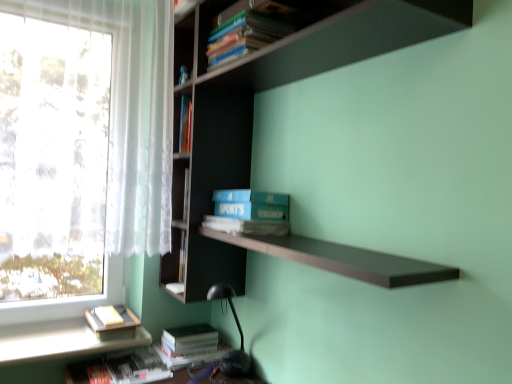
Measure the distance between point (176, 367) and camera.

1.73 meters.

This screenshot has height=384, width=512. What do you see at coordinates (60, 341) in the screenshot?
I see `white matte window sill at lower left` at bounding box center [60, 341].

This screenshot has width=512, height=384. What do you see at coordinates (112, 324) in the screenshot?
I see `hardcover book at lower left, the third book in the top-to-bottom sequence` at bounding box center [112, 324].

Find the location of a particular element. matte blue book at upper center, the fourth book in the bottom-to-top sequence is located at coordinates (183, 75).

Identify the location of hardcover book at lower left, the second book when ordered from bottom to top. The width and height of the screenshot is (512, 384). (190, 345).

Is hardcover book at lower left, the fourth book from the top, facing away from white matte window sill at lower left?

No.

How distant is hardcover book at lower left, the second book when ordered from bottom to top, from white matte window sill at lower left?

hardcover book at lower left, the second book when ordered from bottom to top, and white matte window sill at lower left are 12.50 inches apart.

Is hardcover book at lower left, the fourth book from the top, next to white matte window sill at lower left and touching it?

No.

From the image's perspective, is hardcover book at lower left, the second book when ordered from bottom to top, located beneath white matte window sill at lower left?

Indeed, from the image's perspective, hardcover book at lower left, the second book when ordered from bottom to top, is shown beneath white matte window sill at lower left.

Is dark wood bookcase at upper center a part of matte blue book at upper center, the fourth book in the bottom-to-top sequence?

Actually, dark wood bookcase at upper center is outside matte blue book at upper center, the fourth book in the bottom-to-top sequence.

In the scene shown: Is matte blue book at upper center, the fourth book in the bottom-to-top sequence, oriented away from dark wood bookcase at upper center?

Absolutely, matte blue book at upper center, the fourth book in the bottom-to-top sequence, is directed away from dark wood bookcase at upper center.

From the image's perspective, which object appears higher, matte blue book at upper center, placed as the second book when sorted from top to bottom, or dark wood bookcase at upper center?

matte blue book at upper center, placed as the second book when sorted from top to bottom, from the image's perspective.

In the scene shown: Is blue matte sports book at center facing away from matte blue book at upper center, the fourth book in the bottom-to-top sequence?

blue matte sports book at center does not have its back to matte blue book at upper center, the fourth book in the bottom-to-top sequence.

Does blue matte sports book at center have a greater height compared to matte blue book at upper center, placed as the second book when sorted from top to bottom?

Indeed, blue matte sports book at center has a greater height compared to matte blue book at upper center, placed as the second book when sorted from top to bottom.

From a real-world perspective, is blue matte sports book at center beneath matte blue book at upper center, placed as the second book when sorted from top to bottom?

Correct, in the physical world, blue matte sports book at center is lower than matte blue book at upper center, placed as the second book when sorted from top to bottom.

Considering the relative sizes of blue matte sports book at center and matte blue book at upper center, the fourth book in the bottom-to-top sequence, in the image provided, is blue matte sports book at center thinner than matte blue book at upper center, the fourth book in the bottom-to-top sequence,?

In fact, blue matte sports book at center might be wider than matte blue book at upper center, the fourth book in the bottom-to-top sequence.

Would you say hardcover book at lower left, which is the 5th book from top to bottom, contains dark wood bookcase at upper center?

No, dark wood bookcase at upper center is located outside of hardcover book at lower left, which is the 5th book from top to bottom.

Based on the photo, is hardcover book at lower left, which is the 5th book from top to bottom, at the right side of dark wood bookcase at upper center?

No.

Where is `bookcase that is on the right side of hardcover book at lower left, which is the 5th book from top to bottom`? The image size is (512, 384). bookcase that is on the right side of hardcover book at lower left, which is the 5th book from top to bottom is located at coordinates (254, 114).

From the image's perspective, which is above, hardcover book at lower left, which appears as the 1th book when ordered from the bottom, or dark wood bookcase at upper center?

dark wood bookcase at upper center appears higher in the image.

Does point (262, 8) appear closer or farther from the camera than point (94, 319)?

Point (262, 8) is positioned closer to the camera compared to point (94, 319).

This screenshot has width=512, height=384. What are the coordinates of `the 2nd book above the hardcover book at lower left, the 3th book from the bottom (from the image's perspective)` in the screenshot? It's located at (264, 25).

From the image's perspective, which is above, hardcover books at upper center, marked as the first book in a top-to-bottom arrangement, or hardcover book at lower left, the third book in the top-to-bottom sequence?

hardcover books at upper center, marked as the first book in a top-to-bottom arrangement, appears higher in the image.

From the image's perspective, is hardcover book at lower left, the second book when ordered from bottom to top, located above or below matte blue book at upper center, placed as the second book when sorted from top to bottom?

hardcover book at lower left, the second book when ordered from bottom to top, is situated lower than matte blue book at upper center, placed as the second book when sorted from top to bottom, in the image.

At what (x,y) coordinates should I click in order to perform the action: click on the 2nd book above the hardcover book at lower left, the second book when ordered from bottom to top (from a real-world perspective). Please return your answer as a coordinate pair (x, y). The height and width of the screenshot is (384, 512). Looking at the image, I should click on (183, 75).

How different are the orientations of hardcover book at lower left, the fourth book from the top, and matte blue book at upper center, the fourth book in the bottom-to-top sequence, in degrees?

The angular difference between hardcover book at lower left, the fourth book from the top, and matte blue book at upper center, the fourth book in the bottom-to-top sequence, is 0.175 degrees.

In terms of height, does blue matte sports book at center look taller or shorter compared to hardcover book at lower left, the 3th book from the bottom?

In the image, blue matte sports book at center appears to be taller than hardcover book at lower left, the 3th book from the bottom.

From a real-world perspective, is blue matte sports book at center positioned above or below hardcover book at lower left, the 3th book from the bottom?

blue matte sports book at center is above hardcover book at lower left, the 3th book from the bottom.

Looking at this image, is the depth of blue matte sports book at center greater than that of hardcover book at lower left, the 3th book from the bottom?

No, blue matte sports book at center is closer to the viewer.

Considering the sizes of objects blue matte sports book at center and hardcover book at lower left, the third book in the top-to-bottom sequence, in the image provided, who is bigger, blue matte sports book at center or hardcover book at lower left, the third book in the top-to-bottom sequence,?

With larger size is blue matte sports book at center.

Locate an element on the screen. Image resolution: width=512 pixels, height=384 pixels. window sill lying above the hardcover book at lower left, the second book when ordered from bottom to top (from the image's perspective) is located at coordinates (60, 341).

I want to click on bookcase lying in front of the matte blue book at upper center, placed as the second book when sorted from top to bottom, so pos(254,114).

From the picture: Looking at the image, which one is located further to blue matte sports book at center, dark wood bookcase at upper center or hardcover books at upper center, positioned as the fifth book in bottom-to-top order?

hardcover books at upper center, positioned as the fifth book in bottom-to-top order, is positioned further to the anchor blue matte sports book at center.

From the image, which object appears to be nearer to blue matte sports book at center, hardcover book at lower left, the 3th book from the bottom, or dark wood bookcase at upper center?

dark wood bookcase at upper center.

From the image, which object appears to be farther from white matte window sill at lower left, matte blue book at upper center, the fourth book in the bottom-to-top sequence, or blue matte sports book at center?

Based on the image, matte blue book at upper center, the fourth book in the bottom-to-top sequence, appears to be further to white matte window sill at lower left.

Looking at the image, which one is located closer to matte blue book at upper center, placed as the second book when sorted from top to bottom, hardcover book at lower left, which is the 5th book from top to bottom, or dark wood bookcase at upper center?

Among the two, dark wood bookcase at upper center is located nearer to matte blue book at upper center, placed as the second book when sorted from top to bottom.

Based on the photo, considering their positions, is hardcover book at lower left, the third book in the top-to-bottom sequence, positioned further to dark wood bookcase at upper center than hardcover books at upper center, marked as the first book in a top-to-bottom arrangement?

Among the two, hardcover book at lower left, the third book in the top-to-bottom sequence, is located further to dark wood bookcase at upper center.

Based on their spatial positions, is blue matte sports book at center or matte blue book at upper center, placed as the second book when sorted from top to bottom, closer to hardcover book at lower left, which is the 5th book from top to bottom?

blue matte sports book at center is positioned closer to the anchor hardcover book at lower left, which is the 5th book from top to bottom.

Considering their positions, is hardcover book at lower left, the second book when ordered from bottom to top, positioned closer to hardcover book at lower left, which is the 5th book from top to bottom, than white matte window sill at lower left?

white matte window sill at lower left lies closer to hardcover book at lower left, which is the 5th book from top to bottom, than the other object.

In the scene shown: Which object lies further to the anchor point hardcover books at upper center, marked as the first book in a top-to-bottom arrangement, dark wood bookcase at upper center or matte blue book at upper center, placed as the second book when sorted from top to bottom?

matte blue book at upper center, placed as the second book when sorted from top to bottom, is positioned further to the anchor hardcover books at upper center, marked as the first book in a top-to-bottom arrangement.

The height and width of the screenshot is (384, 512). I want to click on bookcase between matte blue book at upper center, the fourth book in the bottom-to-top sequence, and hardcover book at lower left, which appears as the 1th book when ordered from the bottom, vertically, so click(254, 114).

At what (x,y) coordinates should I click in order to perform the action: click on paperback book between dark wood bookcase at upper center and matte blue book at upper center, the fourth book in the bottom-to-top sequence, along the z-axis. Please return your answer as a coordinate pair (x, y). Looking at the image, I should click on (249, 212).

Where is `paperback book between matte blue book at upper center, the fourth book in the bottom-to-top sequence, and hardcover book at lower left, the third book in the top-to-bottom sequence, from top to bottom`? The height and width of the screenshot is (384, 512). paperback book between matte blue book at upper center, the fourth book in the bottom-to-top sequence, and hardcover book at lower left, the third book in the top-to-bottom sequence, from top to bottom is located at coordinates (249, 212).

Identify the location of book between matte blue book at upper center, the fourth book in the bottom-to-top sequence, and hardcover book at lower left, the fourth book from the top, in the vertical direction. pos(112,324).